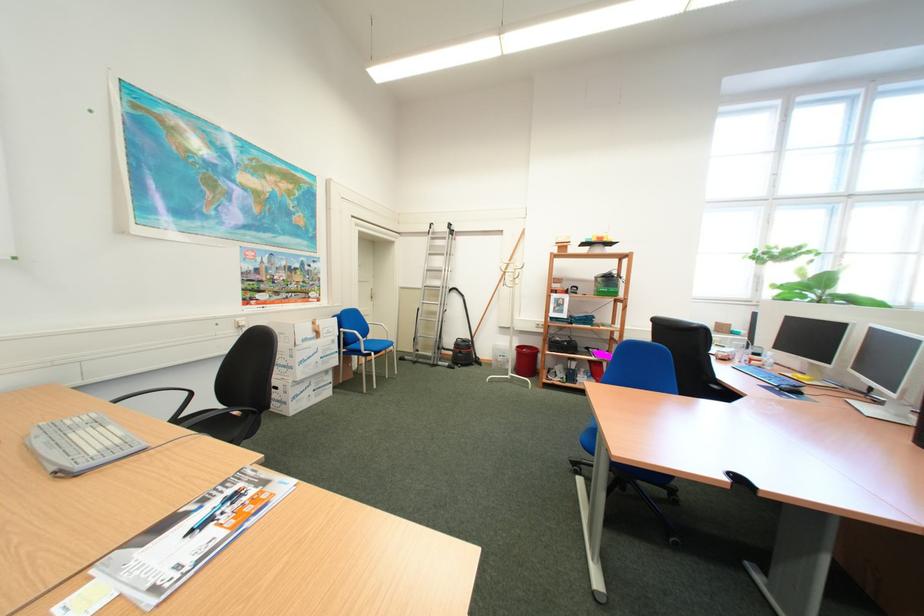
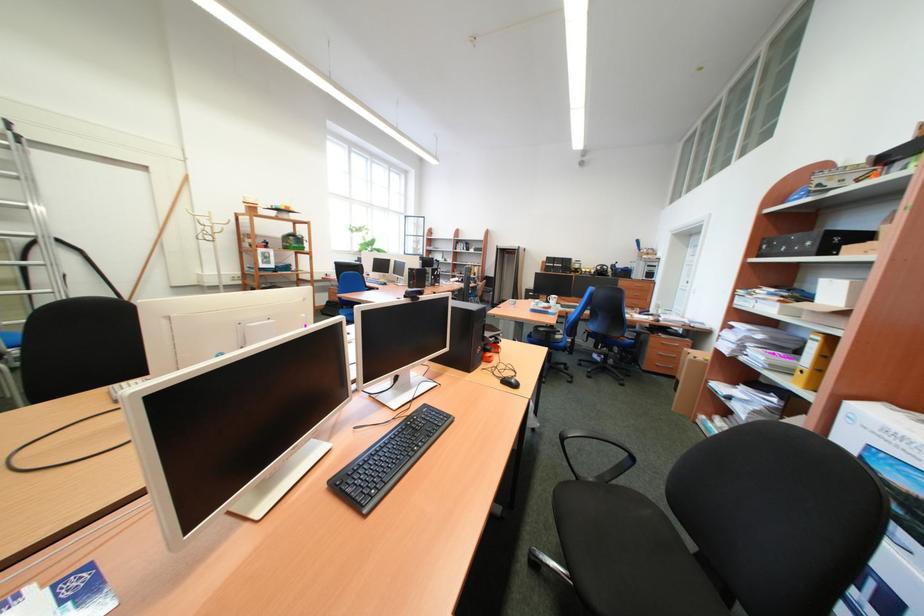
Question: I am providing you with two images of the same scene from different viewpoints. Please identify which objects are invisible in image2.

Choices:
 (A) black chair sitting surface
 (B) red dolly handle
 (C) cardboard box
 (D) pink plastic cup

Answer: (D)